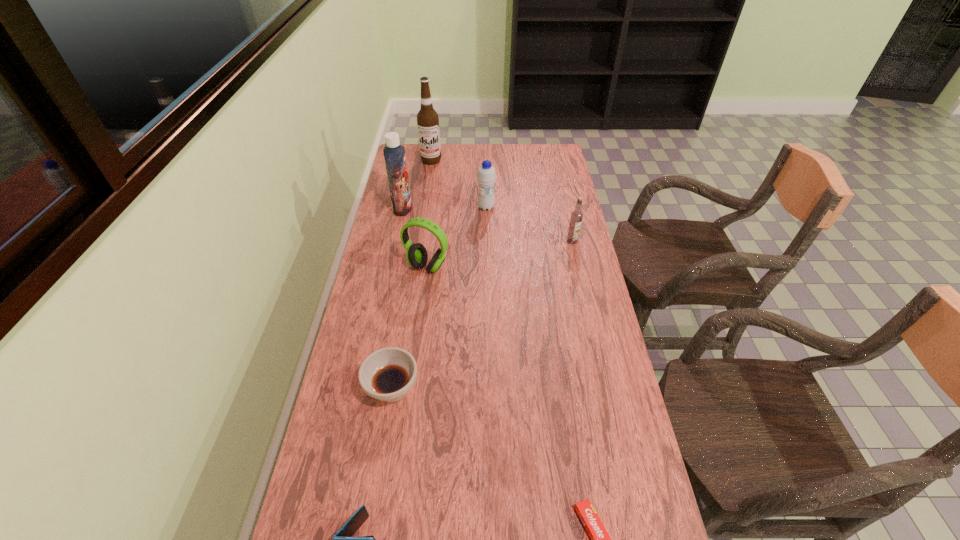
What are the coordinates of `object positioned at the right edge` in the screenshot? It's located at (576, 217).

The width and height of the screenshot is (960, 540). In order to click on object located at the far left corner in this screenshot , I will do `click(427, 118)`.

At what (x,y) coordinates should I click in order to perform the action: click on free spot at the far edge of the desktop. Please return your answer as a coordinate pair (x, y). The height and width of the screenshot is (540, 960). Looking at the image, I should click on (x=500, y=165).

You are a GUI agent. You are given a task and a screenshot of the screen. Output one action in this format:
    pyautogui.click(x=<x>, y=<y>)
    Task: Click on the vacant region at the left edge
    The height and width of the screenshot is (540, 960).
    Given the screenshot: What is the action you would take?
    pyautogui.click(x=414, y=193)

The width and height of the screenshot is (960, 540). I want to click on free region at the right edge, so click(534, 184).

Identify the location of free space at the far right corner of the desktop. (544, 144).

You are a GUI agent. You are given a task and a screenshot of the screen. Output one action in this format:
    pyautogui.click(x=<x>, y=<y>)
    Task: Click on the empty space between the third shortest object and the water bottle
    This screenshot has height=540, width=960.
    Given the screenshot: What is the action you would take?
    (440, 298)

This screenshot has height=540, width=960. I want to click on free spot between the alcohol and the shampoo, so click(417, 184).

This screenshot has width=960, height=540. I want to click on free space between the sixth object from left to right and the shampoo, so click(444, 208).

The height and width of the screenshot is (540, 960). Identify the location of empty space that is in between the tallest object and the water bottle. (459, 184).